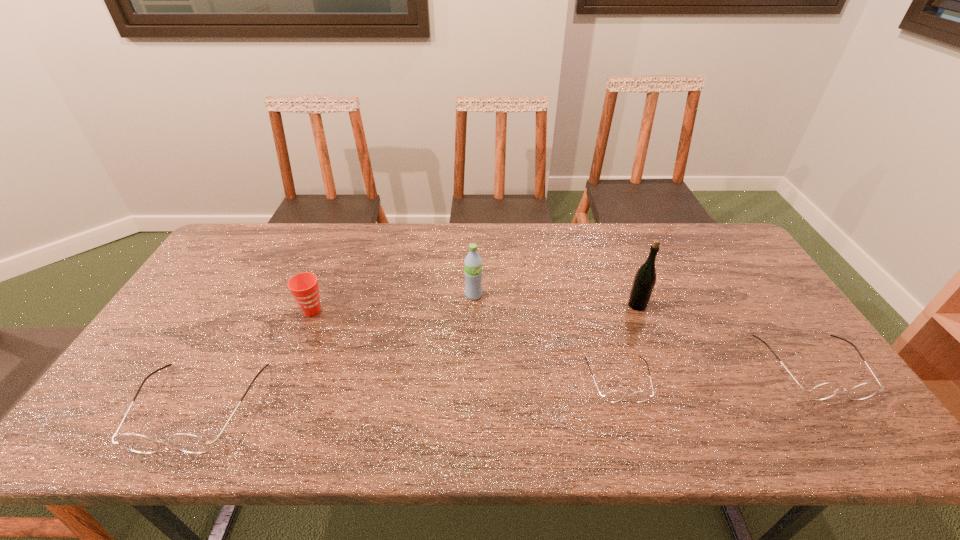
Identify the location of vacant space at the left edge of the desktop. (230, 301).

You are a GUI agent. You are given a task and a screenshot of the screen. Output one action in this format:
    pyautogui.click(x=<x>, y=<y>)
    Task: Click on the vacant region at the right edge of the desktop
    This screenshot has height=540, width=960.
    Given the screenshot: What is the action you would take?
    pyautogui.click(x=748, y=274)

In the image, there is a desktop. At what (x,y) coordinates should I click in order to perform the action: click on vacant space at the near left corner. Please return your answer as a coordinate pair (x, y). Looking at the image, I should click on (140, 393).

Locate an element on the screen. free space at the far right corner of the desktop is located at coordinates (683, 228).

This screenshot has height=540, width=960. In order to click on vacant area between the cup and the leftmost spectacles in this screenshot , I will do `click(255, 359)`.

Where is `free space between the second shortest spectacles and the third object from left to right`? This screenshot has height=540, width=960. free space between the second shortest spectacles and the third object from left to right is located at coordinates (643, 331).

The height and width of the screenshot is (540, 960). Identify the location of free space between the shortest spectacles and the fourth object from right to left. (546, 337).

Locate an element on the screen. free space between the rightmost object and the third tallest object is located at coordinates (563, 339).

The image size is (960, 540). Find the location of `empty space that is in between the second spectacles from right to left and the leftmost object`. empty space that is in between the second spectacles from right to left and the leftmost object is located at coordinates (408, 393).

Where is `blank region between the third object from right to left and the third object from left to right`? blank region between the third object from right to left and the third object from left to right is located at coordinates (546, 337).